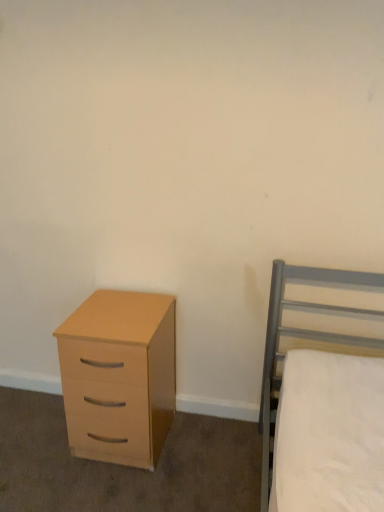
This screenshot has height=512, width=384. Find the location of `light wood/veneer chest of drawers at lower left`. light wood/veneer chest of drawers at lower left is located at coordinates (119, 375).

What do you see at coordinates (119, 375) in the screenshot? I see `light wood/veneer chest of drawers at lower left` at bounding box center [119, 375].

Find the location of a particular element. This screenshot has width=384, height=512. light wood/veneer chest of drawers at lower left is located at coordinates (119, 375).